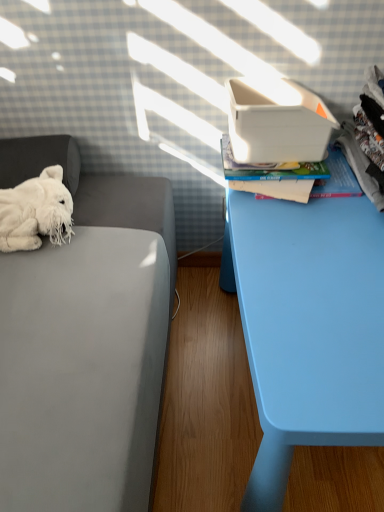
Question: Is white plastic shoe box at upper right in contact with hardcover book at upper right?

Choices:
 (A) yes
 (B) no

Answer: (A)

Question: Considering the relative positions of white plastic shoe box at upper right and hardcover book at upper right in the image provided, is white plastic shoe box at upper right behind hardcover book at upper right?

Choices:
 (A) yes
 (B) no

Answer: (B)

Question: Is white plastic shoe box at upper right wider than hardcover book at upper right?

Choices:
 (A) yes
 (B) no

Answer: (B)

Question: Is white plastic shoe box at upper right positioned in front of hardcover book at upper right?

Choices:
 (A) yes
 (B) no

Answer: (A)

Question: Does white plastic shoe box at upper right have a lesser width compared to hardcover book at upper right?

Choices:
 (A) yes
 (B) no

Answer: (A)

Question: Could you tell me if white plastic shoe box at upper right is turned towards hardcover book at upper right?

Choices:
 (A) no
 (B) yes

Answer: (A)

Question: Is hardcover book at upper right thinner than light blue plastic table at right?

Choices:
 (A) yes
 (B) no

Answer: (A)

Question: Considering the relative positions of hardcover book at upper right and light blue plastic table at right in the image provided, is hardcover book at upper right to the right of light blue plastic table at right from the viewer's perspective?

Choices:
 (A) yes
 (B) no

Answer: (B)

Question: From the image's perspective, is hardcover book at upper right located above light blue plastic table at right?

Choices:
 (A) no
 (B) yes

Answer: (B)

Question: Is hardcover book at upper right wider than light blue plastic table at right?

Choices:
 (A) no
 (B) yes

Answer: (A)

Question: Is hardcover book at upper right aimed at light blue plastic table at right?

Choices:
 (A) yes
 (B) no

Answer: (B)

Question: Does hardcover book at upper right have a larger size compared to light blue plastic table at right?

Choices:
 (A) no
 (B) yes

Answer: (A)

Question: Considering the relative positions of hardcover book at upper right and white plastic shoe box at upper right in the image provided, is hardcover book at upper right to the right of white plastic shoe box at upper right from the viewer's perspective?

Choices:
 (A) yes
 (B) no

Answer: (A)